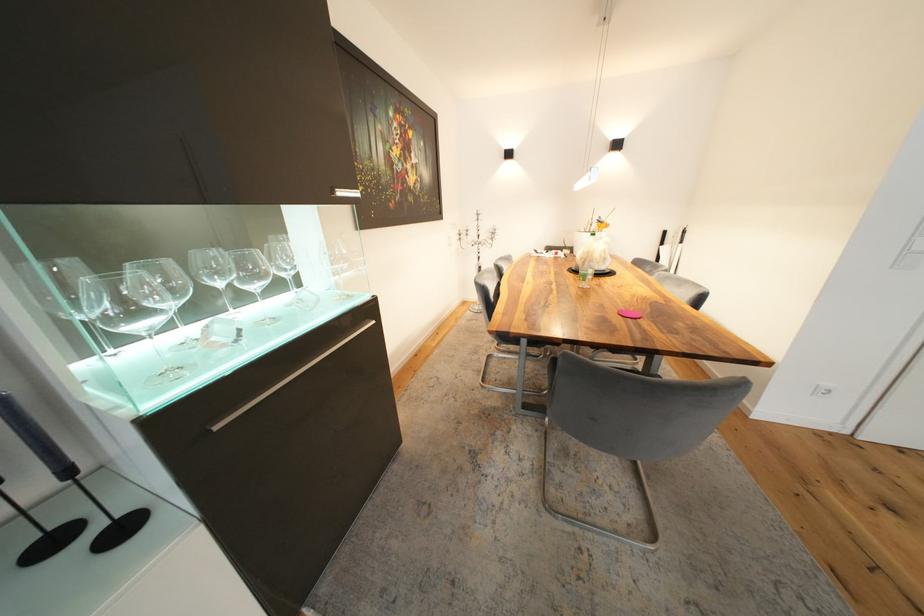
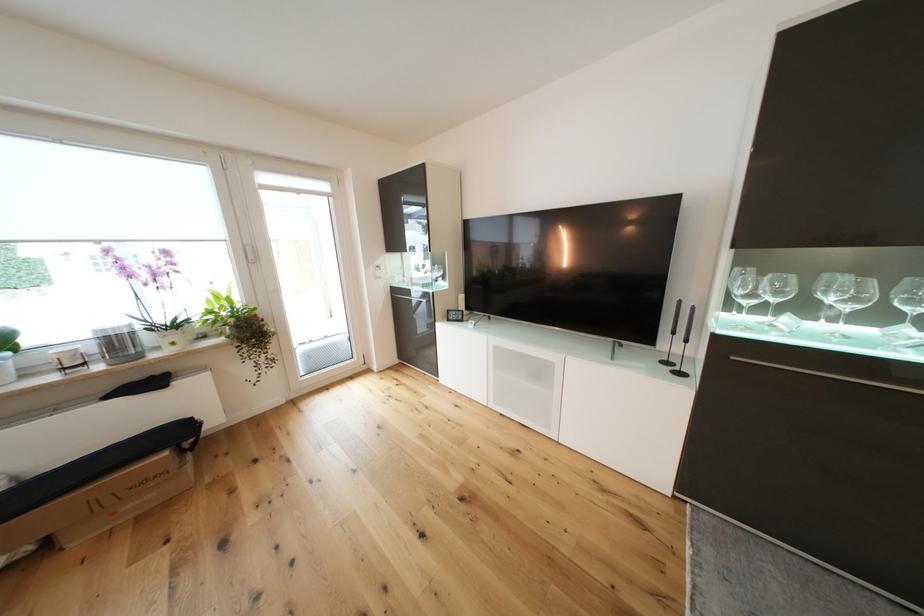
In the second image, find the point that corresponds to the point at 59,545 in the first image.

(674, 365)